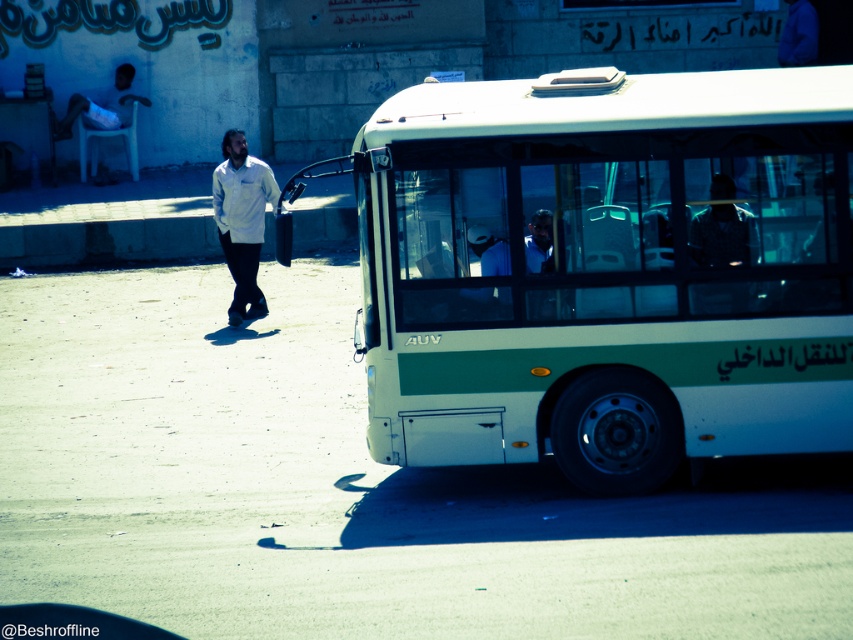
In the scene shown: Between white matte bus at center and white matte shirt at center, which one is positioned higher?

white matte shirt at center is above.

At what (x,y) coordinates should I click in order to perform the action: click on white matte bus at center. Please return your answer as a coordinate pair (x, y). The height and width of the screenshot is (640, 853). Looking at the image, I should click on (608, 269).

Does point (527, 435) come closer to viewer compared to point (262, 164)?

Yes, it is.

The image size is (853, 640). I want to click on white matte bus at center, so click(608, 269).